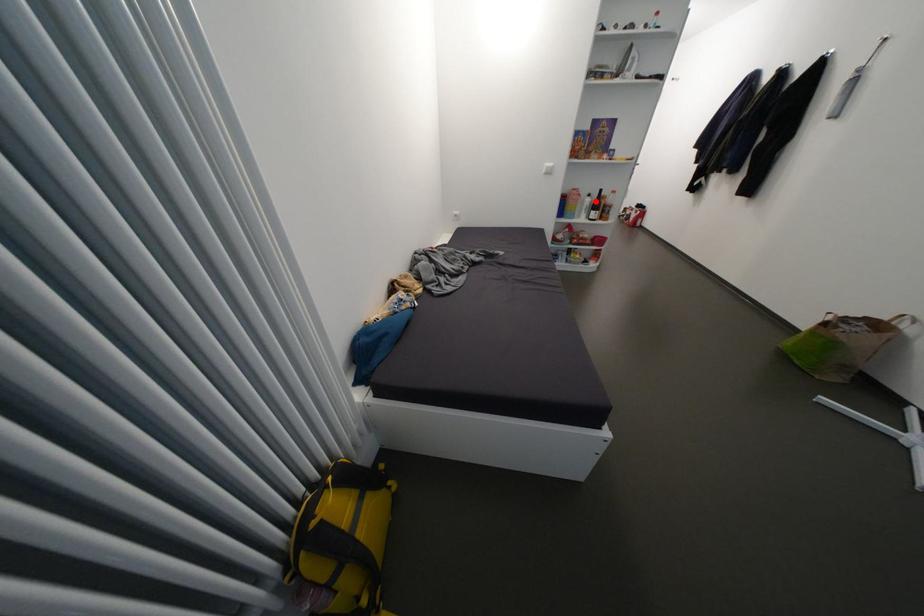
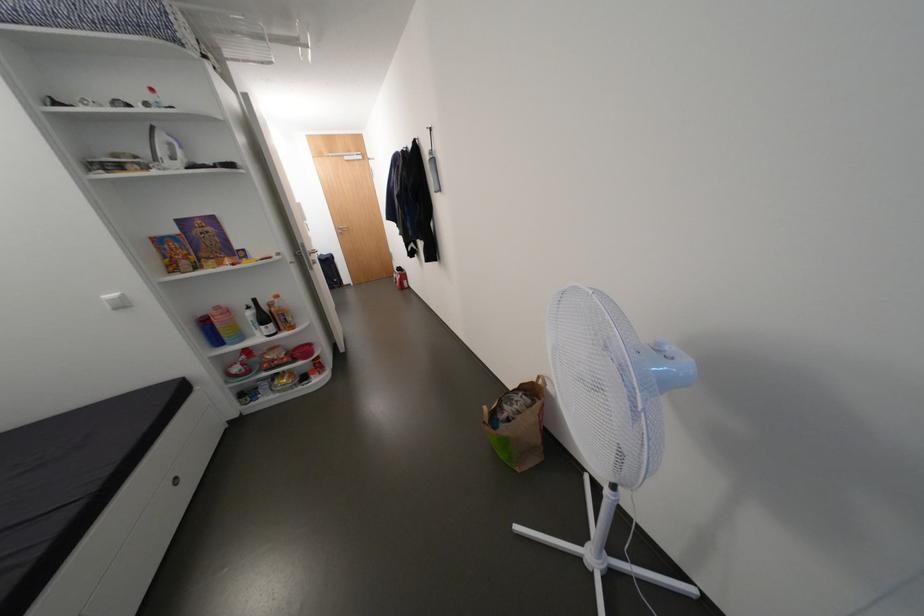
Question: I am providing you with two images of the same scene from different viewpoints. A red point is shown in image1. For the corresponding object point in image2, is it positioned nearer or farther from the camera?

Choices:
 (A) Nearer
 (B) Farther

Answer: (B)